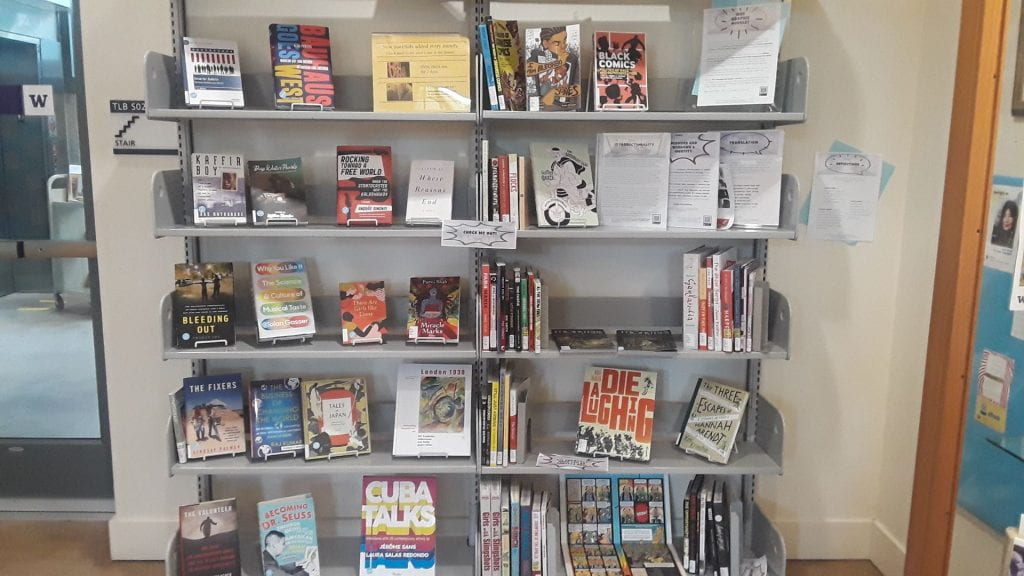
At what (x,y) coordinates should I click in order to perform the action: click on book shelf. Please return your answer as a coordinate pair (x, y). Image resolution: width=1024 pixels, height=576 pixels. Looking at the image, I should click on (670, 447), (378, 447), (350, 111), (676, 113).